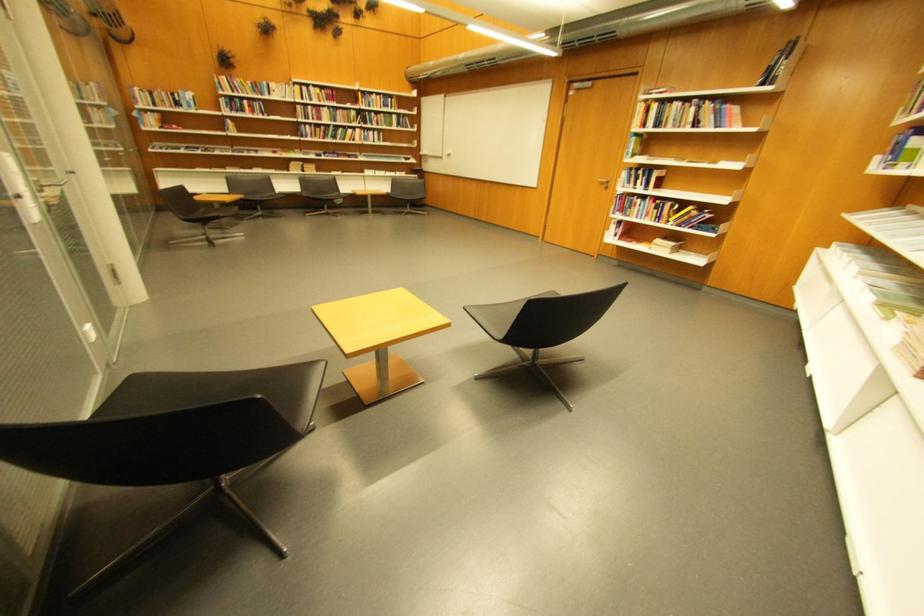
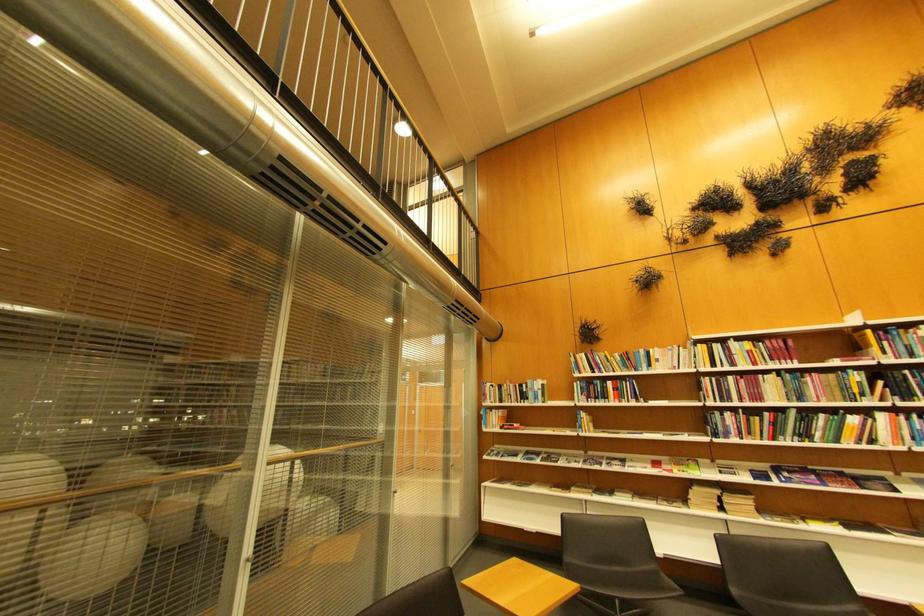
Question: I am providing you with two images of the same scene from different viewpoints. After the viewpoint changes to image2, which objects are now occluded?

Choices:
 (A) journal on shelf
 (B) book on shelf
 (C) black chair sitting surface
 (D) none of these

Answer: (D)